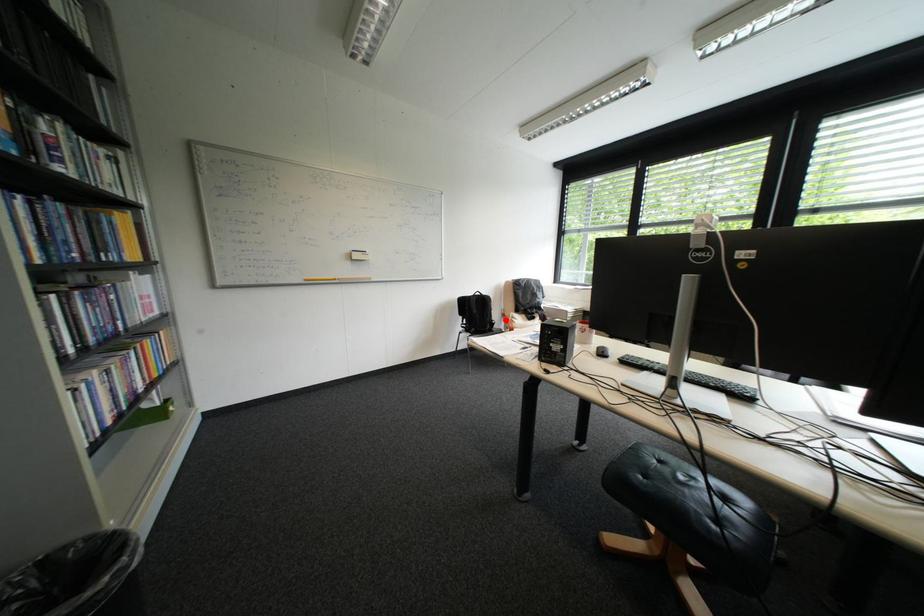
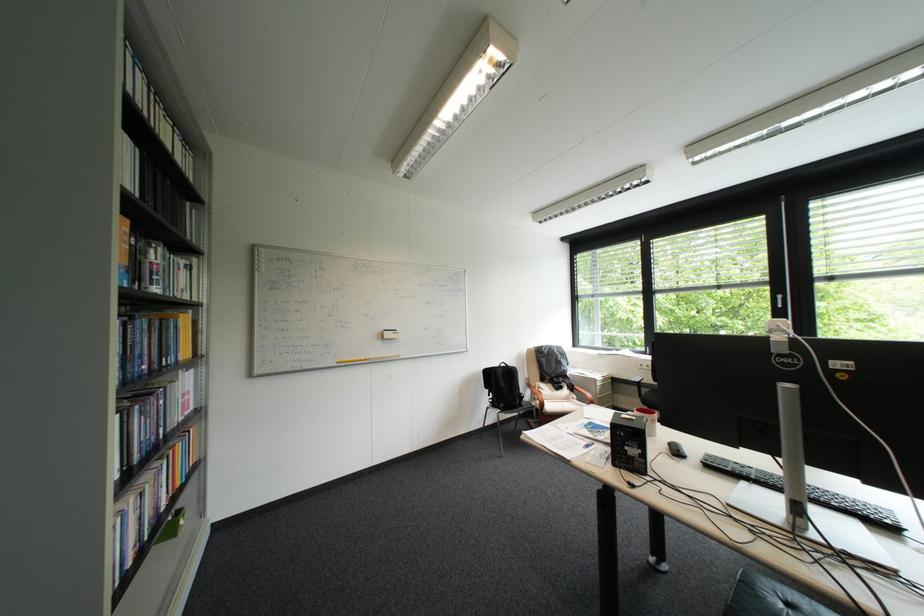
Question: A red point is marked in image1. In image2, is the corresponding 3D point closer to the camera or farther? Reply with the corresponding letter.

Choices:
 (A) The corresponding 3D point is closer.
 (B) The corresponding 3D point is farther.

Answer: (B)